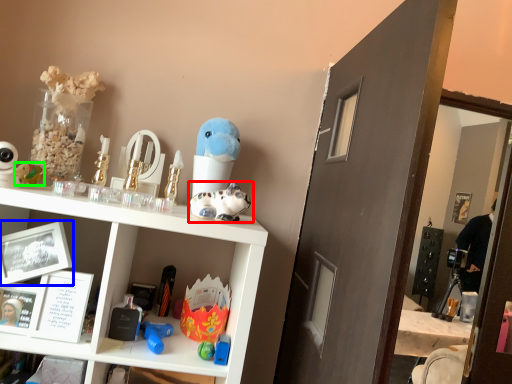
Question: Which object is positioned closest to toy (highlighted by a red box)? Select from picture frame (highlighted by a blue box) and toy (highlighted by a green box).

Choices:
 (A) picture frame
 (B) toy

Answer: (A)